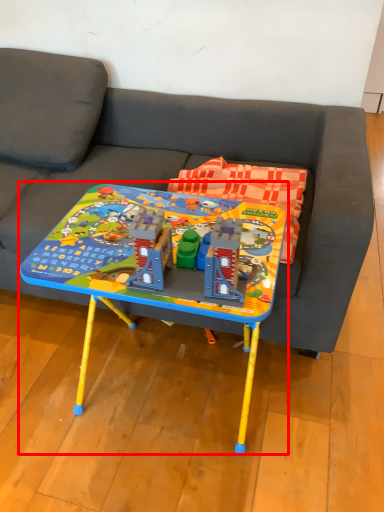
Question: From the image's perspective, what is the correct spatial positioning of table (annotated by the red box) in reference to studio couch?

Choices:
 (A) above
 (B) below

Answer: (B)